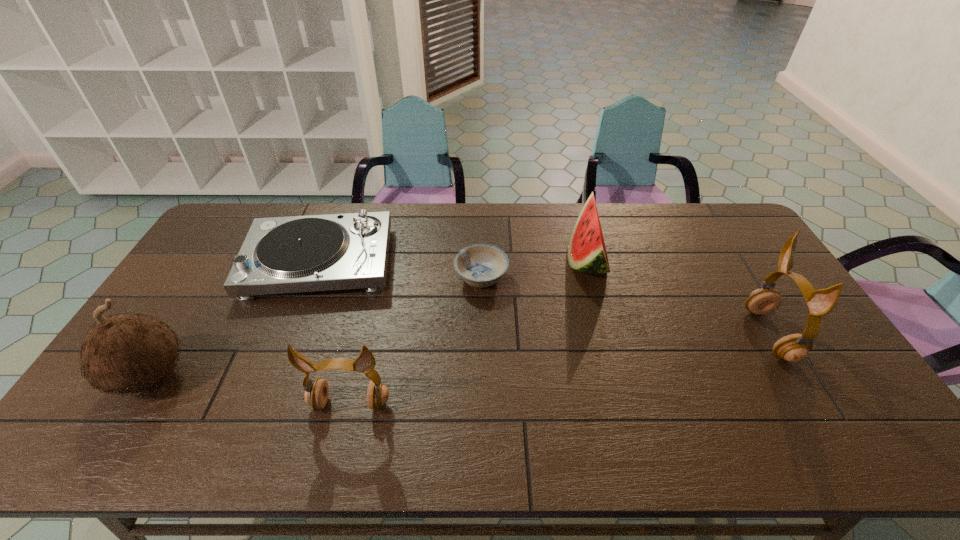
Locate an element on the screen. Image resolution: width=960 pixels, height=540 pixels. earphone at the near edge is located at coordinates (316, 393).

Identify the location of coconut that is at the near edge. click(128, 352).

Locate an element on the screen. This screenshot has width=960, height=540. object present at the left edge is located at coordinates (128, 352).

At what (x,y) coordinates should I click in order to perform the action: click on object that is at the right edge. Please return your answer as a coordinate pair (x, y). Image resolution: width=960 pixels, height=540 pixels. Looking at the image, I should click on (794, 348).

You are a GUI agent. You are given a task and a screenshot of the screen. Output one action in this format:
    pyautogui.click(x=<x>, y=<y>)
    Task: Click on the object positioned at the near left corner
    The width and height of the screenshot is (960, 540).
    Given the screenshot: What is the action you would take?
    pyautogui.click(x=128, y=352)

This screenshot has width=960, height=540. I want to click on vacant region at the far edge of the desktop, so click(x=539, y=220).

The height and width of the screenshot is (540, 960). I want to click on vacant position at the near edge of the desktop, so click(x=279, y=401).

Locate an element on the screen. free region at the left edge of the desktop is located at coordinates (172, 312).

This screenshot has height=540, width=960. I want to click on free location at the right edge of the desktop, so click(745, 273).

The width and height of the screenshot is (960, 540). What are the coordinates of `vacant space at the near right corner` in the screenshot? It's located at (807, 395).